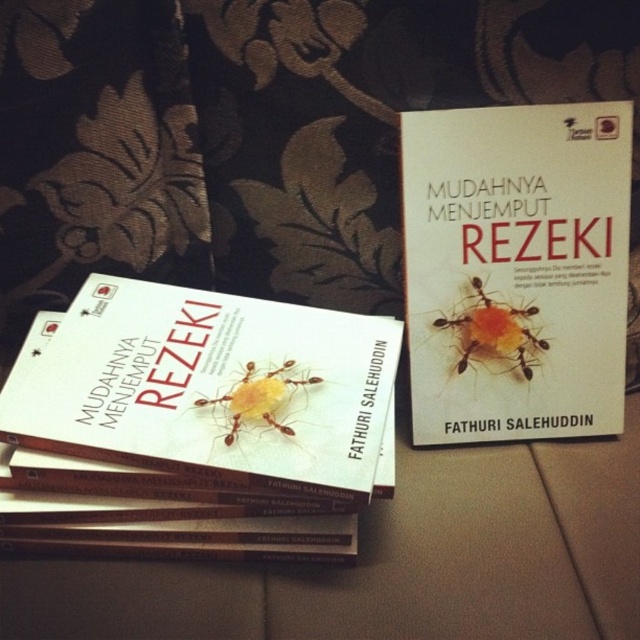
Question: Which point is farther to the camera?

Choices:
 (A) white matte book at upper right
 (B) yellow matte insect at center

Answer: (B)

Question: Which point appears farthest from the camera in this image?

Choices:
 (A) (525, 330)
 (B) (172, 412)

Answer: (A)

Question: In this image, where is white matte book at upper right located relative to white matte book at center?

Choices:
 (A) right
 (B) left

Answer: (A)

Question: Is white matte book at center to the right of yellow matte insect at center from the viewer's perspective?

Choices:
 (A) yes
 (B) no

Answer: (B)

Question: Which is farther from the yellow matte insect at center?

Choices:
 (A) white matte book at center
 (B) yellow matte ant at center
 (C) white matte book at upper right

Answer: (A)

Question: Where is white matte book at upper right located in relation to yellow matte insect at center in the image?

Choices:
 (A) right
 (B) left

Answer: (A)